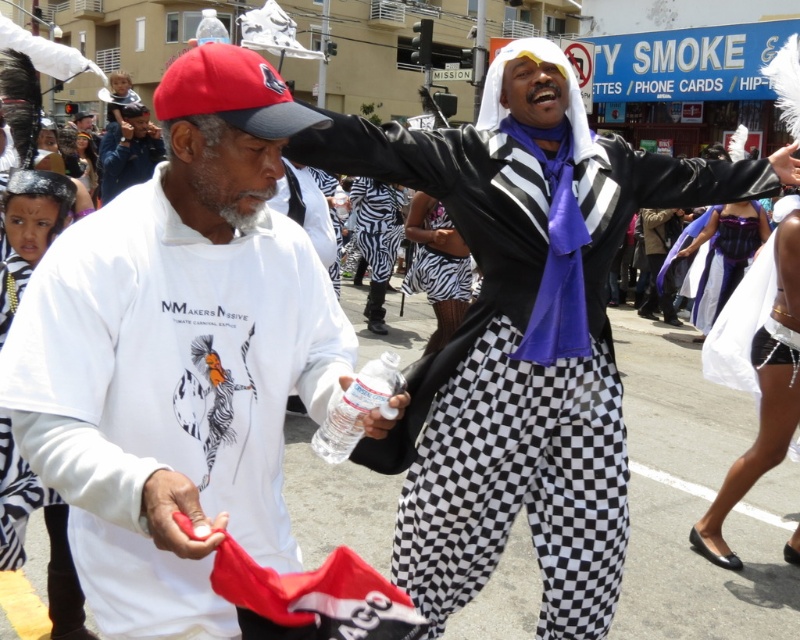
Question: Does white matte t-shirt at center have a greater width compared to zebra print pants at center?

Choices:
 (A) yes
 (B) no

Answer: (A)

Question: Which point is farther from the camera taking this photo?

Choices:
 (A) (608, 420)
 (B) (156, 481)
 (C) (454, 275)

Answer: (C)

Question: Is white matte t-shirt at center above matte black jacket at center?

Choices:
 (A) yes
 (B) no

Answer: (B)

Question: Is the position of white matte t-shirt at center less distant than that of zebra print pants at center?

Choices:
 (A) no
 (B) yes

Answer: (B)

Question: Which of the following is the farthest from the observer?

Choices:
 (A) (176, 196)
 (B) (542, 438)
 (C) (444, 282)

Answer: (C)

Question: Estimate the real-world distances between objects in this image. Which object is closer to the white matte t-shirt at center?

Choices:
 (A) zebra print pants at center
 (B) matte black jacket at center

Answer: (B)